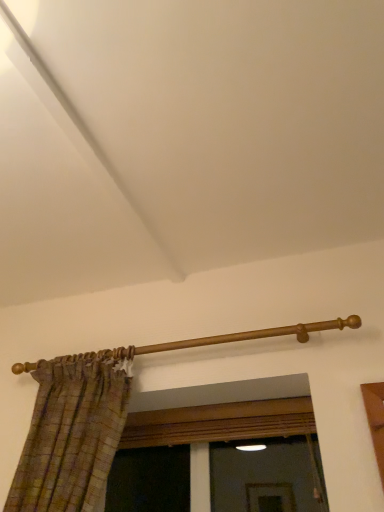
Question: Should I look upward or downward to see wooden curtain rod at upper center?

Choices:
 (A) up
 (B) down

Answer: (B)

Question: Is wooden curtain rod at upper center smaller than wooden frame at center?

Choices:
 (A) no
 (B) yes

Answer: (B)

Question: From a real-world perspective, is wooden curtain rod at upper center located beneath wooden frame at center?

Choices:
 (A) no
 (B) yes

Answer: (A)

Question: Does wooden curtain rod at upper center come in front of wooden frame at center?

Choices:
 (A) no
 (B) yes

Answer: (B)

Question: Is wooden curtain rod at upper center at the right side of wooden frame at center?

Choices:
 (A) yes
 (B) no

Answer: (B)

Question: Is wooden curtain rod at upper center oriented away from wooden frame at center?

Choices:
 (A) no
 (B) yes

Answer: (A)

Question: From the image's perspective, is wooden curtain rod at upper center on wooden frame at center?

Choices:
 (A) yes
 (B) no

Answer: (A)

Question: Is wooden frame at center at the right side of wooden curtain rod at upper center?

Choices:
 (A) no
 (B) yes

Answer: (B)

Question: Does wooden frame at center touch wooden curtain rod at upper center?

Choices:
 (A) yes
 (B) no

Answer: (B)

Question: Can you confirm if wooden frame at center is bigger than wooden curtain rod at upper center?

Choices:
 (A) no
 (B) yes

Answer: (B)

Question: Considering the relative positions of wooden frame at center and wooden curtain rod at upper center in the image provided, is wooden frame at center to the left of wooden curtain rod at upper center from the viewer's perspective?

Choices:
 (A) no
 (B) yes

Answer: (A)

Question: Does wooden frame at center have a lesser height compared to wooden curtain rod at upper center?

Choices:
 (A) no
 (B) yes

Answer: (A)

Question: Can you confirm if wooden frame at center is smaller than wooden curtain rod at upper center?

Choices:
 (A) yes
 (B) no

Answer: (B)

Question: Considering the positions of wooden curtain rod at upper center and wooden frame at center in the image, is wooden curtain rod at upper center taller or shorter than wooden frame at center?

Choices:
 (A) short
 (B) tall

Answer: (A)